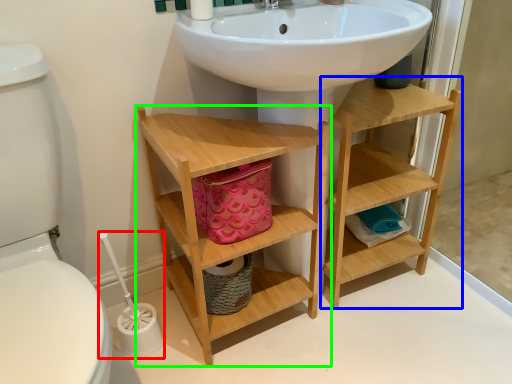
Question: Estimate the real-world distances between objects in this image. Which object is farther from brush (highlighted by a red box), shelf (highlighted by a blue box) or bathroom cabinet (highlighted by a green box)?

Choices:
 (A) shelf
 (B) bathroom cabinet

Answer: (A)